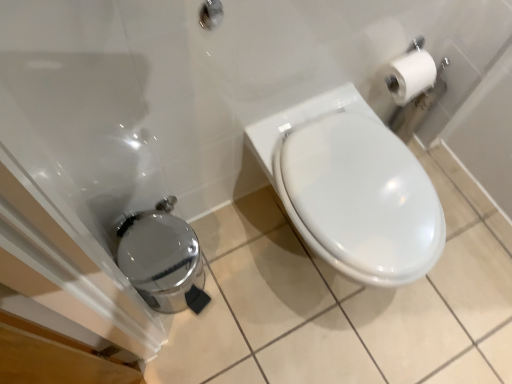
Question: Is polished stainless steel trash can at lower left to the left or to the right of white glossy toilet at center in the image?

Choices:
 (A) left
 (B) right

Answer: (A)

Question: Would you say polished stainless steel trash can at lower left is inside or outside white glossy toilet at center?

Choices:
 (A) outside
 (B) inside

Answer: (A)

Question: Estimate the real-world distances between objects in this image. Which object is farther from the white glossy toilet at center?

Choices:
 (A) brushed metal showerhead at upper center
 (B) polished stainless steel trash can at lower left

Answer: (A)

Question: Which object is positioned farthest from the polished stainless steel trash can at lower left?

Choices:
 (A) white glossy toilet at center
 (B) brushed metal showerhead at upper center

Answer: (B)